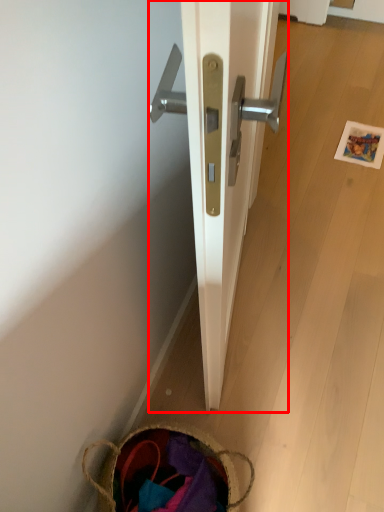
Question: From the image's perspective, where is door (annotated by the red box) located relative to basket?

Choices:
 (A) above
 (B) below

Answer: (A)